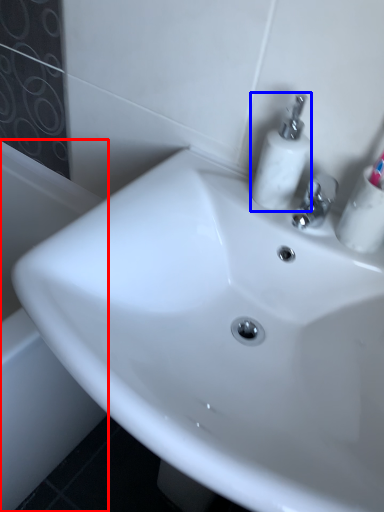
Question: Which object is further to the camera taking this photo, bath (highlighted by a red box) or soap dispenser (highlighted by a blue box)?

Choices:
 (A) bath
 (B) soap dispenser

Answer: (A)